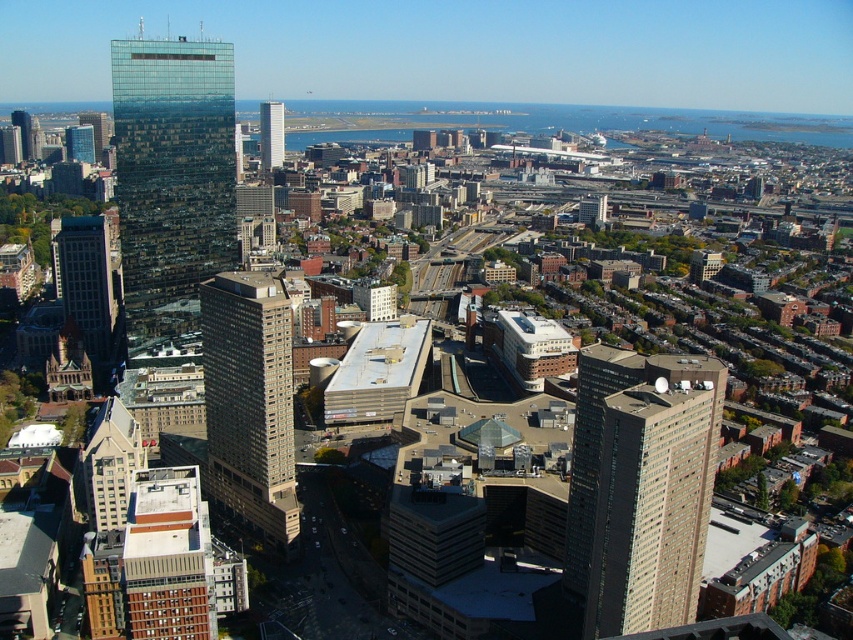
You are a drone operator flying a drone that needs to capture a photo of the beige concrete building at center and the matte glass skyscraper at left. Since the drone can only focus on one object at a time, which building should you focus on first to ensure it appears larger in the photo?

The beige concrete building at center should be focused on first because it is closer to the viewer, making it appear larger in the photo compared to the matte glass skyscraper at left which is farther away.

You are a city planner analyzing the urban layout. You need to determine which of the two buildings, the beige concrete building at center or the matte glass skyscraper at left, has a narrower width. Which one is it?

The beige concrete building at center is thinner than the matte glass skyscraper at left, so the beige concrete building at center has a narrower width.

You are a city planner analyzing the urban layout. You notice the beige glass building at right and the beige concrete building at center. Which of these two buildings occupies more space in the city layout?

The beige glass building at right is larger in size than the beige concrete building at center, so it occupies more space in the city layout.